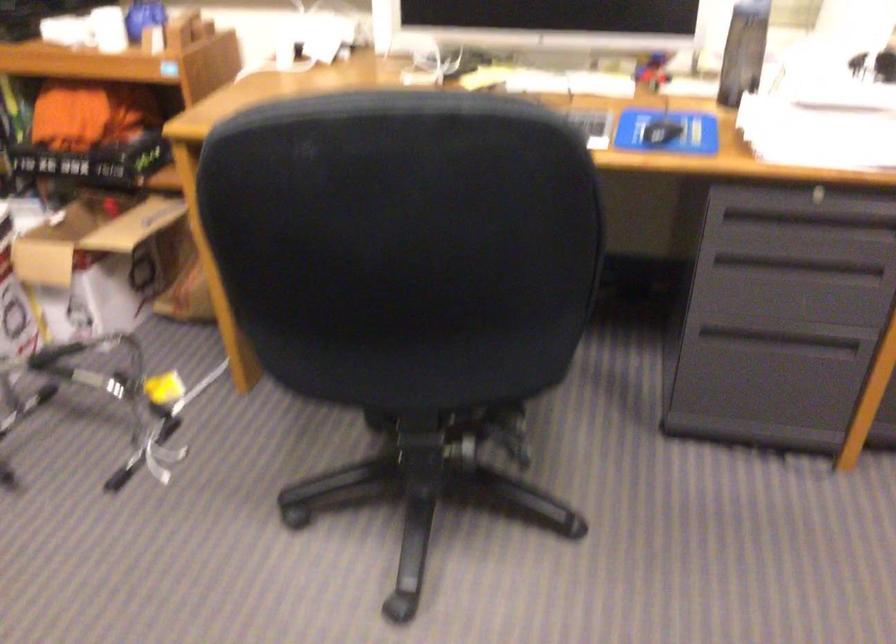
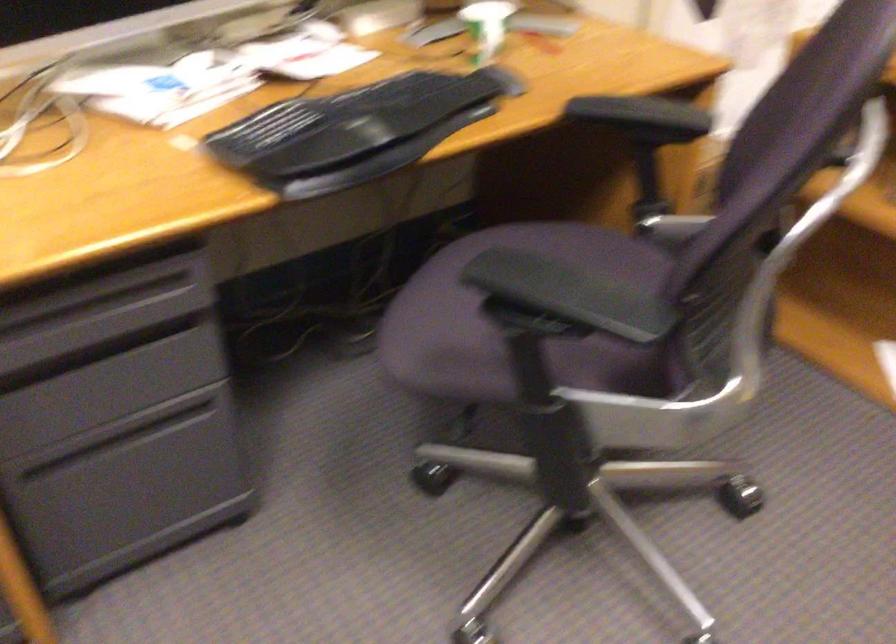
Question: The camera is either moving clockwise (left) or counter-clockwise (right) around the object. The first image is from the beginning of the video and the second image is from the end. Is the camera moving left or right when shooting the video?

Choices:
 (A) Left
 (B) Right

Answer: (A)